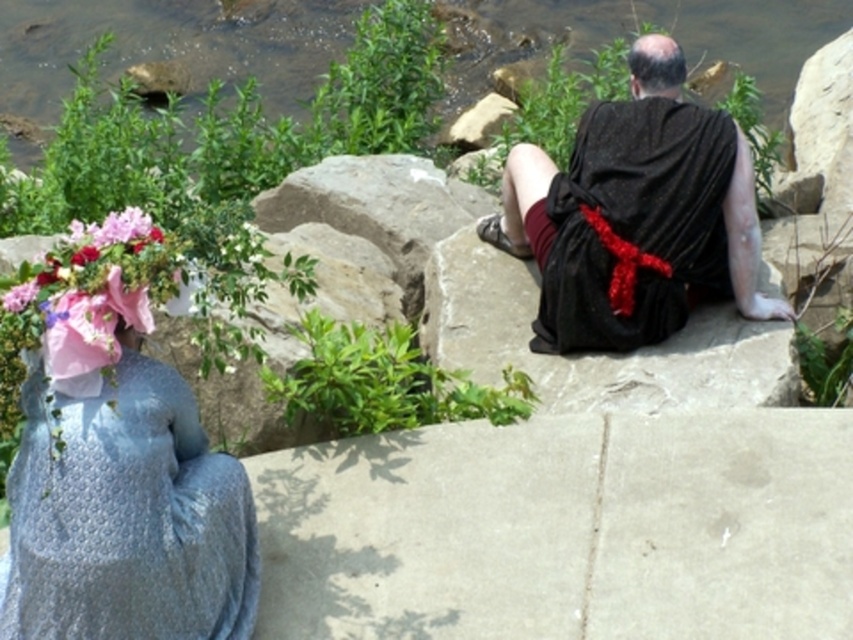
Is point (94, 362) closer to camera compared to point (672, 45)?

Yes, point (94, 362) is in front of point (672, 45).

I want to click on pink fabric bouquet at left, so click(x=91, y=296).

Identify the location of pink fabric bouquet at left. (x=91, y=296).

Which is more to the left, shiny blue dress at lower left or pink fabric bouquet at left?

shiny blue dress at lower left

Is point (245, 595) more distant than point (9, 330)?

Yes, point (245, 595) is behind point (9, 330).

What do you see at coordinates (119, 461) in the screenshot? I see `shiny blue dress at lower left` at bounding box center [119, 461].

In order to click on shiny blue dress at lower left in this screenshot , I will do `click(119, 461)`.

Is black satin robe at upper right shorter than bald head at upper center?

No, black satin robe at upper right is not shorter than bald head at upper center.

What do you see at coordinates (633, 225) in the screenshot?
I see `black satin robe at upper right` at bounding box center [633, 225].

Locate an element on the screen. black satin robe at upper right is located at coordinates (633, 225).